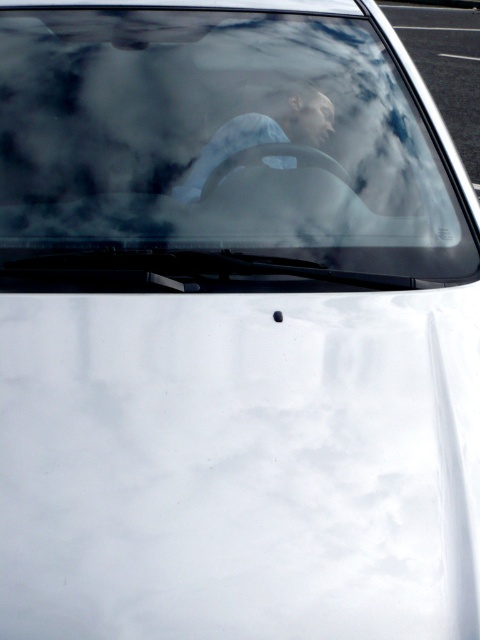
You are a drone operator flying a drone that can only travel up to 10 meters. You need to fly from the transparent glass windshield at upper center to the asphalt at upper right. Can you safely make this trip without exceeding your drone maximum range?

The transparent glass windshield at upper center is 11.76 meters away from asphalt at upper right. Since the drone can only travel up to 10 meters, it cannot safely make the trip as the distance exceeds its maximum range.

You are standing next to the car and looking at the front section. There is a point labeled as point (445,67). Based on the scene, what is the material at that point?

The point (445,67) indicates asphalt at upper right, so the material at that point is asphalt.

You are a passenger in the car and want to see the driver clearly. Which object is closer to you between the transparent glass windshield at upper center and the blue fabric shirt at center?

The transparent glass windshield at upper center is closer to you because it is in front of the blue fabric shirt at center.